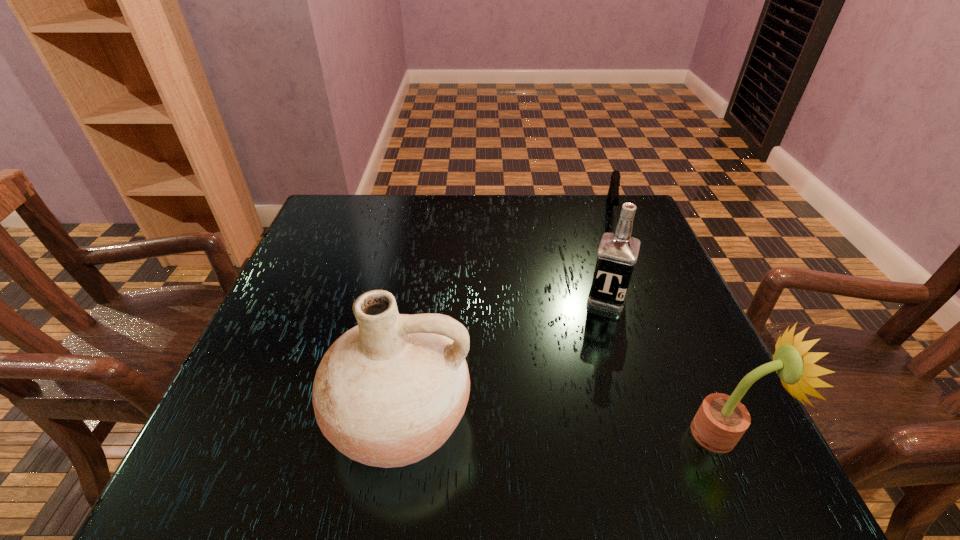
At what (x,y) coordinates should I click in order to perform the action: click on free space on the desktop that is between the leftmost object and the sunflower and is positioned on the front label of the third nearest object. Please return your answer as a coordinate pair (x, y). This screenshot has height=540, width=960. Looking at the image, I should click on (573, 426).

At what (x,y) coordinates should I click in order to perform the action: click on vacant space on the desktop that is between the leftmost object and the sunflower and is positioned on the front-facing side of the shortest object. Please return your answer as a coordinate pair (x, y). This screenshot has height=540, width=960. Looking at the image, I should click on (605, 428).